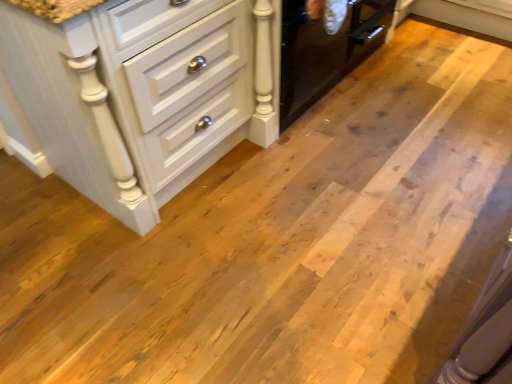
Locate an element on the screen. white painted wood chest of drawers at left is located at coordinates (144, 93).

What do you see at coordinates (144, 93) in the screenshot? The height and width of the screenshot is (384, 512). I see `white painted wood chest of drawers at left` at bounding box center [144, 93].

Identify the location of white painted wood chest of drawers at left. The width and height of the screenshot is (512, 384). (144, 93).